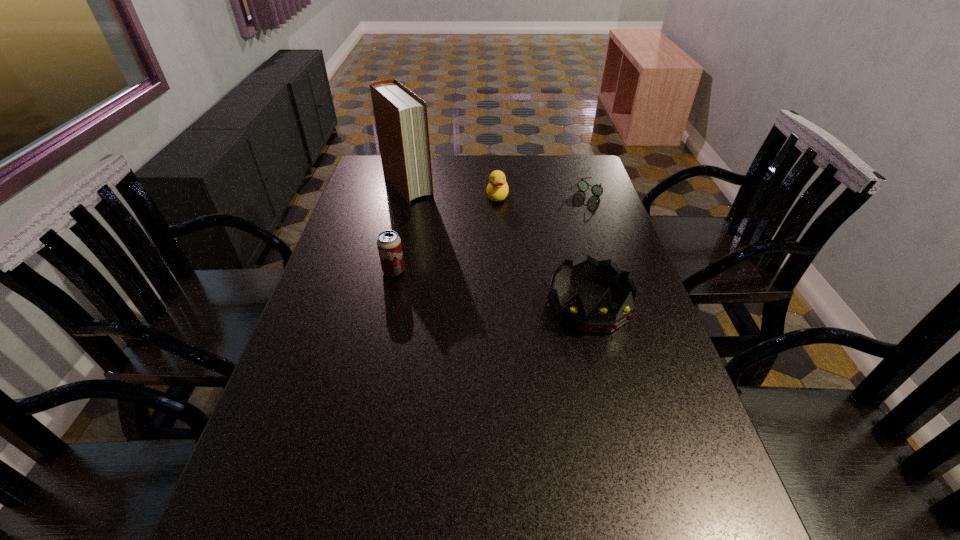
Locate an element on the screen. The width and height of the screenshot is (960, 540). free space in the image that satisfies the following two spatial constraints: 1. on the front side of the spectacles; 2. on the right side of the duckling is located at coordinates (497, 198).